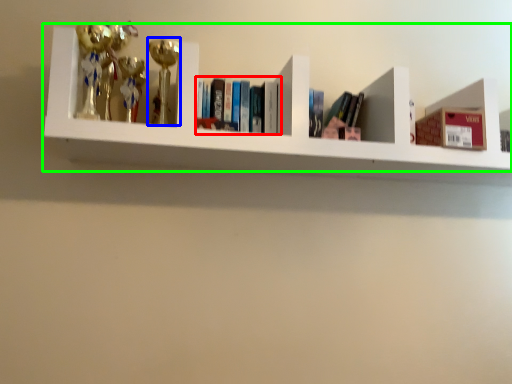
Question: Which object is positioned farthest from book (highlighted by a red box)? Select from toy (highlighted by a blue box) and shelf (highlighted by a green box).

Choices:
 (A) toy
 (B) shelf

Answer: (B)